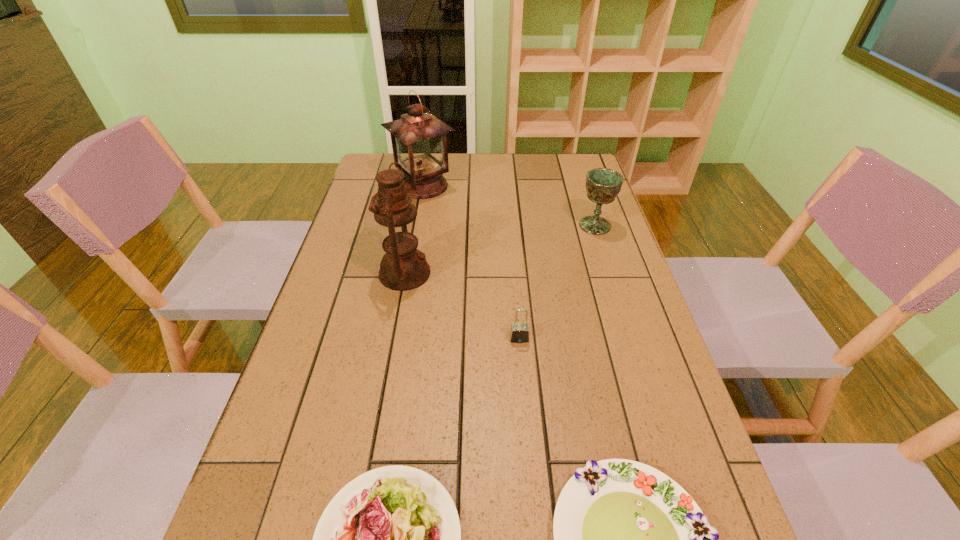
Find the location of a particular element. the farther oil lamp is located at coordinates (419, 139).

Locate an element on the screen. the fourth nearest object is located at coordinates (403, 267).

Where is `the fifth nearest object`? This screenshot has height=540, width=960. the fifth nearest object is located at coordinates (603, 185).

This screenshot has width=960, height=540. In order to click on chalice in this screenshot , I will do `click(603, 185)`.

Locate an element on the screen. The image size is (960, 540). the third object from right to left is located at coordinates (519, 332).

Image resolution: width=960 pixels, height=540 pixels. Identify the location of the fourth farthest object. (519, 332).

The image size is (960, 540). Find the location of `vacant space located on the front of the farther oil lamp`. vacant space located on the front of the farther oil lamp is located at coordinates (406, 281).

At what (x,y) coordinates should I click in order to perform the action: click on vacant space positioned 0.200m on the back of the fourth nearest object. Please return your answer as a coordinate pair (x, y). Looking at the image, I should click on (416, 213).

The width and height of the screenshot is (960, 540). Identify the location of blank space located on the front of the second farthest object. (629, 330).

You are a GUI agent. You are given a task and a screenshot of the screen. Output one action in this format:
    pyautogui.click(x=<x>, y=<y>)
    Task: Click on the vacant space located on the shackle of the fourth farthest object
    
    Given the screenshot: What is the action you would take?
    pyautogui.click(x=526, y=420)